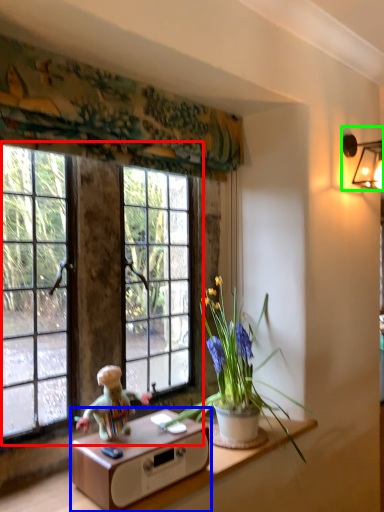
Question: Which object is positioned farthest from window (highlighted by a red box)? Select from table (highlighted by a blue box) and lamp (highlighted by a green box).

Choices:
 (A) table
 (B) lamp

Answer: (B)